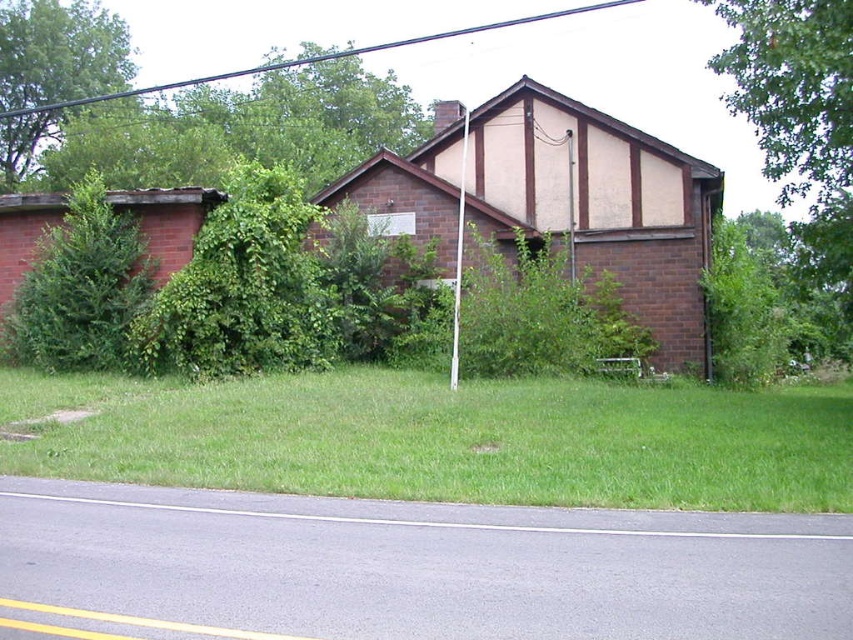
Between green grass at lower center and green leafy tree at upper left, which one is positioned higher?

green leafy tree at upper left is higher up.

Which of these two, green grass at lower center or green leafy tree at upper left, stands taller?

green leafy tree at upper left

Is point (804, 410) in front of point (22, 33)?

That is True.

The height and width of the screenshot is (640, 853). Identify the location of green grass at lower center. (445, 438).

Which of these two, green grass at lower center or green leafy tree at left, stands taller?

green leafy tree at left

Between point (572, 440) and point (102, 326), which one is positioned behind?

The point (102, 326) is more distant.

What do you see at coordinates (445, 438) in the screenshot? This screenshot has width=853, height=640. I see `green grass at lower center` at bounding box center [445, 438].

Image resolution: width=853 pixels, height=640 pixels. Identify the location of green grass at lower center. tap(445, 438).

Is point (27, 288) behind point (53, 1)?

No, it is not.

Locate an element on the screen. The image size is (853, 640). green leafy tree at left is located at coordinates (80, 288).

The height and width of the screenshot is (640, 853). What do you see at coordinates (80, 288) in the screenshot?
I see `green leafy tree at left` at bounding box center [80, 288].

Image resolution: width=853 pixels, height=640 pixels. In order to click on green leafy tree at left in this screenshot , I will do `click(80, 288)`.